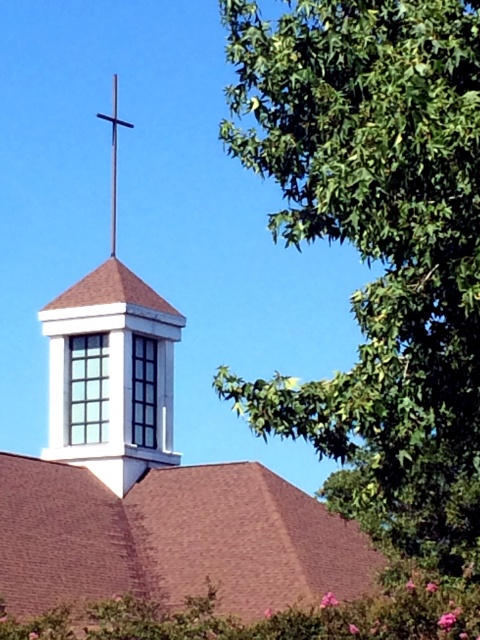
Question: Is brown shingles at center in front of white matte cross at upper center?

Choices:
 (A) no
 (B) yes

Answer: (B)

Question: In this image, where is brown shingles at center located relative to black metal cross at upper center?

Choices:
 (A) above
 (B) below

Answer: (B)

Question: Can you confirm if green leafy tree at upper right is positioned below white matte steeple at center?

Choices:
 (A) yes
 (B) no

Answer: (B)

Question: Which point is closer to the camera?

Choices:
 (A) white matte cross at upper center
 (B) brown shingles at center

Answer: (B)

Question: Which object appears farthest from the camera in this image?

Choices:
 (A) white matte cross at upper center
 (B) white matte steeple at center
 (C) green leafy tree at upper right
 (D) black metal cross at upper center

Answer: (D)

Question: Among these points, which one is farthest from the camera?

Choices:
 (A) coord(99,528)
 (B) coord(444,109)
 (C) coord(299,600)
 (D) coord(99,337)

Answer: (D)